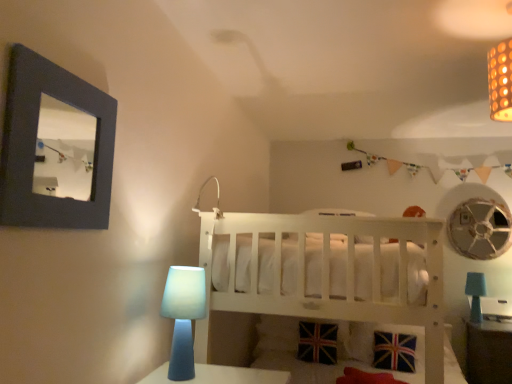
Image resolution: width=512 pixels, height=384 pixels. What do you see at coordinates (55, 147) in the screenshot?
I see `dark gray matte picture frame at upper left` at bounding box center [55, 147].

Measure the distance between point (319, 243) and camera.

Point (319, 243) and camera are 1.76 meters apart.

Measure the distance between point (476,286) and camera.

Point (476,286) and camera are 3.54 meters apart from each other.

How much space does blue matte table lamp at lower right, which appears as the 1th table lamp when ordered from the bottom, occupy horizontally?

The width of blue matte table lamp at lower right, which appears as the 1th table lamp when ordered from the bottom, is 6.32 inches.

You are a GUI agent. You are given a task and a screenshot of the screen. Output one action in this format:
    pyautogui.click(x=<x>, y=<y>)
    Task: Click on the union jack fabric pillow at lower center
    The height and width of the screenshot is (384, 512).
    Given the screenshot: What is the action you would take?
    pyautogui.click(x=374, y=341)

Is dark gray matte picture frame at upper left located within metallic silver mechanical fan at upper right?

Definitely not — dark gray matte picture frame at upper left is not inside metallic silver mechanical fan at upper right.

Is metallic silver mechanical fan at upper right oriented towards dark gray matte picture frame at upper left?

No, metallic silver mechanical fan at upper right is not facing towards dark gray matte picture frame at upper left.

From the image's perspective, which object appears higher, metallic silver mechanical fan at upper right or dark gray matte picture frame at upper left?

dark gray matte picture frame at upper left is shown above in the image.

Can you tell me how much metallic silver mechanical fan at upper right and matte brown table at lower right differ in facing direction?

There is a 2.41-degree angle between the facing directions of metallic silver mechanical fan at upper right and matte brown table at lower right.

In the scene shown: Which of these two, metallic silver mechanical fan at upper right or matte brown table at lower right, is bigger?

matte brown table at lower right is bigger.

Is the position of metallic silver mechanical fan at upper right less distant than that of matte brown table at lower right?

No, the depth of metallic silver mechanical fan at upper right is greater than that of matte brown table at lower right.

Considering the sizes of metallic silver mechanical fan at upper right and matte brown table at lower right in the image, is metallic silver mechanical fan at upper right taller or shorter than matte brown table at lower right?

Clearly, metallic silver mechanical fan at upper right is shorter compared to matte brown table at lower right.

Does matte brown table at lower right turn towards metallic silver mechanical fan at upper right?

No, matte brown table at lower right does not turn towards metallic silver mechanical fan at upper right.

Is matte brown table at lower right surrounding metallic silver mechanical fan at upper right?

No.

Looking at this image, is matte brown table at lower right thinner than metallic silver mechanical fan at upper right?

No, matte brown table at lower right is not thinner than metallic silver mechanical fan at upper right.

Could you measure the distance between matte brown table at lower right and metallic silver mechanical fan at upper right?

matte brown table at lower right and metallic silver mechanical fan at upper right are 31.38 inches apart from each other.

Is matte white lamp at upper center further to the viewer compared to union jack fabric pillow at lower center?

No, matte white lamp at upper center is closer to the camera.

Looking at this image, can you tell me how much matte white lamp at upper center and union jack fabric pillow at lower center differ in facing direction?

The facing directions of matte white lamp at upper center and union jack fabric pillow at lower center are 1.18 degrees apart.

Is matte white lamp at upper center oriented towards union jack fabric pillow at lower center?

No, matte white lamp at upper center does not turn towards union jack fabric pillow at lower center.

Based on the photo, from the image's perspective, is matte white lamp at upper center located beneath union jack fabric pillow at lower center?

Actually, matte white lamp at upper center appears above union jack fabric pillow at lower center in the image.

Is blue matte table lamp at lower left, which is the first table lamp from top to bottom, positioned beyond the bounds of matte brown table at lower right?

blue matte table lamp at lower left, which is the first table lamp from top to bottom, lies outside matte brown table at lower right's area.

In terms of width, does blue matte table lamp at lower left, placed as the first table lamp when sorted from front to back, look wider or thinner when compared to matte brown table at lower right?

blue matte table lamp at lower left, placed as the first table lamp when sorted from front to back, is thinner than matte brown table at lower right.

From the image's perspective, is blue matte table lamp at lower left, which is the first table lamp from top to bottom, above or below matte brown table at lower right?

Based on their image positions, blue matte table lamp at lower left, which is the first table lamp from top to bottom, is located above matte brown table at lower right.

From a real-world perspective, is blue matte table lamp at lower left, which is counted as the 2th table lamp, starting from the bottom, above or below matte brown table at lower right?

From a real-world perspective, blue matte table lamp at lower left, which is counted as the 2th table lamp, starting from the bottom, is physically above matte brown table at lower right.

Which object is further away from the camera, blue matte table lamp at lower right, which appears as the 1th table lamp when ordered from the bottom, or matte white lamp at upper center?

blue matte table lamp at lower right, which appears as the 1th table lamp when ordered from the bottom, is behind.

Is blue matte table lamp at lower right, which is the first table lamp from right to left, in contact with matte white lamp at upper center?

No, blue matte table lamp at lower right, which is the first table lamp from right to left, is not next to matte white lamp at upper center.

Is blue matte table lamp at lower right, positioned as the first table lamp in back-to-front order, taller than matte white lamp at upper center?

Yes.

Locate an element on the screen. lamp above the blue matte table lamp at lower right, which ranks as the 2th table lamp in top-to-bottom order (from the image's perspective) is located at coordinates (216, 202).

Is dark gray matte picture frame at upper left wider or thinner than matte brown table at lower right?

dark gray matte picture frame at upper left is thinner than matte brown table at lower right.

Which is nearer, (5, 159) or (485, 326)?

Point (5, 159)

Considering the sizes of dark gray matte picture frame at upper left and matte brown table at lower right in the image, is dark gray matte picture frame at upper left taller or shorter than matte brown table at lower right?

Clearly, dark gray matte picture frame at upper left is shorter compared to matte brown table at lower right.

Are dark gray matte picture frame at upper left and matte brown table at lower right making contact?

They are not placed beside each other.

Find the location of a particular element. picture frame that is above the metallic silver mechanical fan at upper right (from a real-world perspective) is located at coordinates (55, 147).

Where is `table below the metallic silver mechanical fan at upper right (from a real-world perspective)`? The height and width of the screenshot is (384, 512). table below the metallic silver mechanical fan at upper right (from a real-world perspective) is located at coordinates (488, 352).

When comparing their distances from white wooden crib at center, does matte brown table at lower right or union jack fabric pillow at lower center seem further?

Among the two, matte brown table at lower right is located further to white wooden crib at center.

Considering their positions, is union jack fabric pillow at lower center positioned closer to white wooden crib at center than matte brown table at lower right?

union jack fabric pillow at lower center.

From the image, which object appears to be farther from blue matte table lamp at lower right, which ranks as the 2th table lamp in top-to-bottom order, blue matte table lamp at lower left, which appears as the 2th table lamp when viewed from the right, or white wooden crib at center?

Among the two, blue matte table lamp at lower left, which appears as the 2th table lamp when viewed from the right, is located further to blue matte table lamp at lower right, which ranks as the 2th table lamp in top-to-bottom order.

Estimate the real-world distances between objects in this image. Which object is further from metallic silver mechanical fan at upper right, white wooden crib at center or dark gray matte picture frame at upper left?

dark gray matte picture frame at upper left is positioned further to the anchor metallic silver mechanical fan at upper right.

Estimate the real-world distances between objects in this image. Which object is closer to blue matte table lamp at lower right, positioned as the first table lamp in back-to-front order, blue matte table lamp at lower left, which is counted as the 2th table lamp, starting from the bottom, or dark gray matte picture frame at upper left?

blue matte table lamp at lower left, which is counted as the 2th table lamp, starting from the bottom, is positioned closer to the anchor blue matte table lamp at lower right, positioned as the first table lamp in back-to-front order.

From the image, which object appears to be nearer to dark gray matte picture frame at upper left, union jack fabric pillow at lower center or matte brown table at lower right?

union jack fabric pillow at lower center lies closer to dark gray matte picture frame at upper left than the other object.

From the image, which object appears to be nearer to matte brown table at lower right, metallic silver mechanical fan at upper right or matte white lamp at upper center?

Based on the image, metallic silver mechanical fan at upper right appears to be nearer to matte brown table at lower right.

Looking at the image, which one is located closer to matte brown table at lower right, dark gray matte picture frame at upper left or blue matte table lamp at lower left, acting as the second table lamp starting from the back?

Based on the image, blue matte table lamp at lower left, acting as the second table lamp starting from the back, appears to be nearer to matte brown table at lower right.

Find the location of a particular element. This screenshot has height=384, width=512. table lamp located between matte white lamp at upper center and matte brown table at lower right in the left-right direction is located at coordinates (475, 294).

Where is `infant bed positioned between dark gray matte picture frame at upper left and union jack fabric pillow at lower center from near to far`? This screenshot has width=512, height=384. infant bed positioned between dark gray matte picture frame at upper left and union jack fabric pillow at lower center from near to far is located at coordinates (326, 272).

Find the location of a particular element. The width and height of the screenshot is (512, 384). pillow between blue matte table lamp at lower left, acting as the second table lamp starting from the back, and blue matte table lamp at lower right, positioned as the first table lamp in back-to-front order, from left to right is located at coordinates (374, 341).

Image resolution: width=512 pixels, height=384 pixels. I want to click on table lamp between matte white lamp at upper center and metallic silver mechanical fan at upper right in the horizontal direction, so click(475, 294).